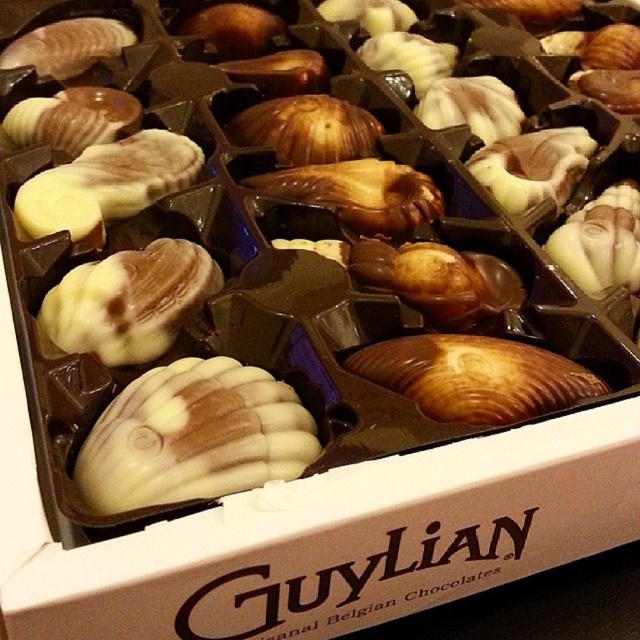
Who is positioned more to the right, white chocolate seashell at center or matte brown seashell at center?

From the viewer's perspective, matte brown seashell at center appears more on the right side.

How far apart are white chocolate seashell at center and matte brown seashell at center?

They are 7.37 inches apart.

Is point (92, 472) behind point (385, 387)?

No, it is not.

Where is `white chocolate seashell at center`? white chocolate seashell at center is located at coordinates click(193, 436).